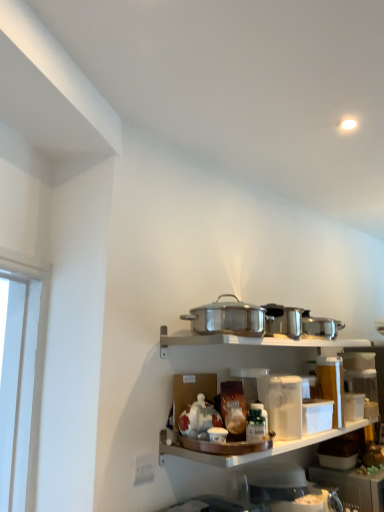
Question: Is white plastic container at lower right, which is the 1th appliance from bottom to top, taller or shorter than white matte container at center?

Choices:
 (A) tall
 (B) short

Answer: (A)

Question: Considering the positions of point (380, 477) and point (251, 458), is point (380, 477) closer or farther from the camera than point (251, 458)?

Choices:
 (A) farther
 (B) closer

Answer: (A)

Question: Which is nearer to the stainless steel pot at center, arranged as the first appliance when viewed from the left?

Choices:
 (A) white plastic container at lower right, the 2th appliance positioned from the left
 (B) white matte container at center

Answer: (B)

Question: Which object is positioned farthest from the white matte container at center?

Choices:
 (A) white plastic container at lower right, which appears as the second appliance when viewed from the top
 (B) stainless steel pot at center, arranged as the first appliance when viewed from the left

Answer: (B)